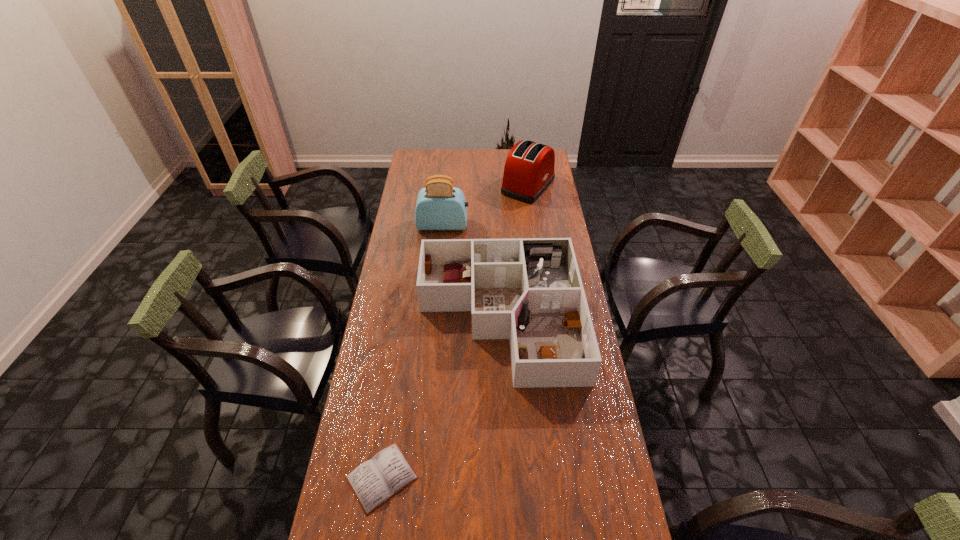
At what (x,y) coordinates should I click in order to perform the action: click on vacant space that satisfies the following two spatial constraints: 1. on the side of the nearer toaster with the lever; 2. on the front side of the shortest object. Please return your answer as a coordinate pair (x, y). The width and height of the screenshot is (960, 540). Looking at the image, I should click on (420, 477).

The width and height of the screenshot is (960, 540). Find the location of `vacant space that satisfies the following two spatial constraints: 1. on the side of the left toaster with the lever; 2. on the right side of the second shortest object`. vacant space that satisfies the following two spatial constraints: 1. on the side of the left toaster with the lever; 2. on the right side of the second shortest object is located at coordinates (434, 318).

The image size is (960, 540). Find the location of `blank space that satisfies the following two spatial constraints: 1. on the side of the left toaster with the lever; 2. on the left side of the third tallest object`. blank space that satisfies the following two spatial constraints: 1. on the side of the left toaster with the lever; 2. on the left side of the third tallest object is located at coordinates (434, 318).